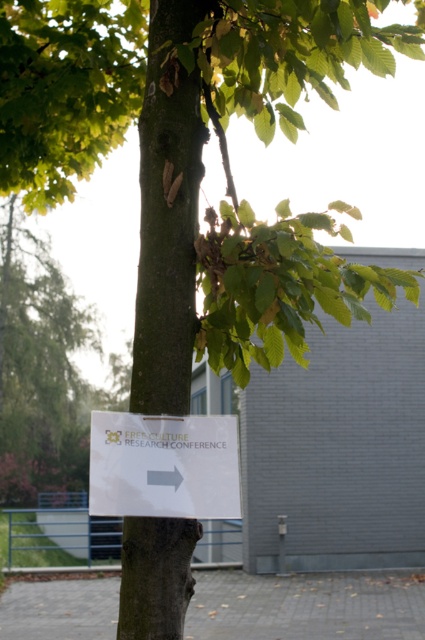
Question: Is smooth brown bark at center wider than gray concrete pavement at lower center?

Choices:
 (A) no
 (B) yes

Answer: (A)

Question: Based on their relative distances, which object is nearer to the white paper sign at center?

Choices:
 (A) smooth brown bark at center
 (B) gray concrete pavement at lower center

Answer: (A)

Question: Which point is closer to the camera taking this photo?

Choices:
 (A) (167, 576)
 (B) (87, 628)
 (C) (170, 502)

Answer: (C)

Question: Can you confirm if gray concrete pavement at lower center is wider than white paper sign at center?

Choices:
 (A) no
 (B) yes

Answer: (B)

Question: Can you confirm if gray concrete pavement at lower center is positioned above white paper sign at center?

Choices:
 (A) yes
 (B) no

Answer: (B)

Question: Which point is farther to the camera?

Choices:
 (A) white paper sign at center
 (B) smooth brown bark at center
 (C) gray concrete pavement at lower center

Answer: (C)